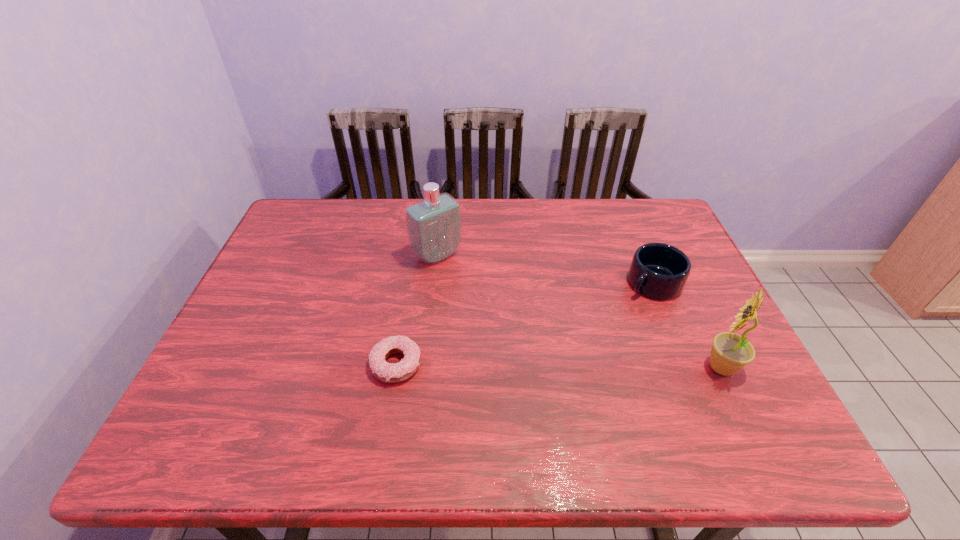
Identify the location of vacant space situated with the handle on the side of the second shortest object. (621, 307).

Locate an element on the screen. free point located on the front label of the perfume is located at coordinates (524, 344).

I want to click on free location located 0.280m on the front label of the perfume, so click(510, 329).

Locate an element on the screen. The height and width of the screenshot is (540, 960). vacant space positioned on the front label of the perfume is located at coordinates (495, 314).

Where is `object located in the far edge section of the desktop`? This screenshot has height=540, width=960. object located in the far edge section of the desktop is located at coordinates (434, 225).

Locate an element on the screen. The height and width of the screenshot is (540, 960). doughnut that is at the near edge is located at coordinates point(389,373).

Locate an element on the screen. Image resolution: width=960 pixels, height=540 pixels. sunflower that is positioned at the near edge is located at coordinates tap(730, 352).

Find the location of a particular element. The image size is (960, 540). sunflower that is at the right edge is located at coordinates (730, 352).

I want to click on mug located in the right edge section of the desktop, so click(660, 271).

The width and height of the screenshot is (960, 540). Identify the location of object present at the near right corner. (730, 352).